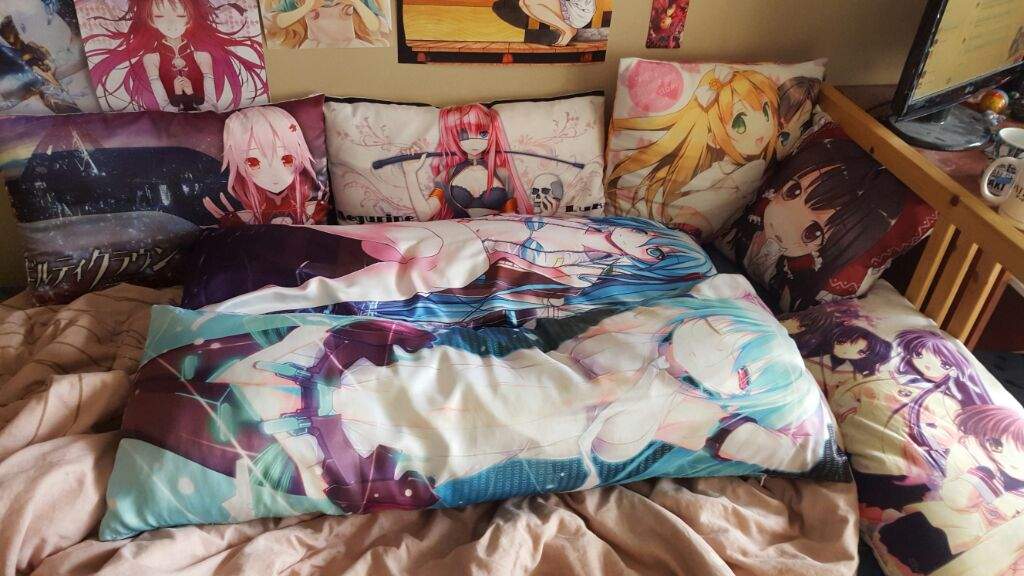
Identify the location of comforter sheets. The height and width of the screenshot is (576, 1024). (54, 404).